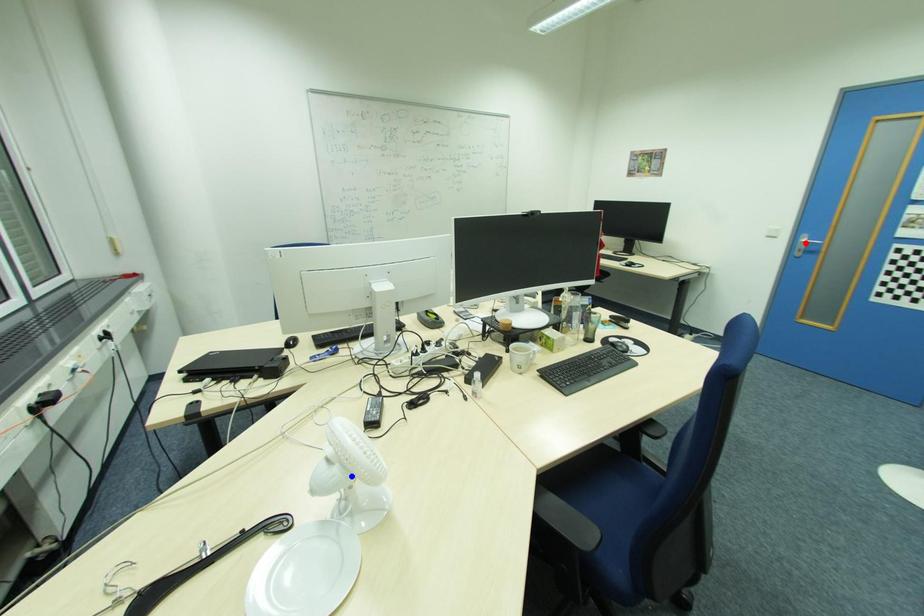
Question: Two points are marked on the image. Which point is closer to the camera?

Choices:
 (A) Blue point is closer.
 (B) Red point is closer.

Answer: (A)